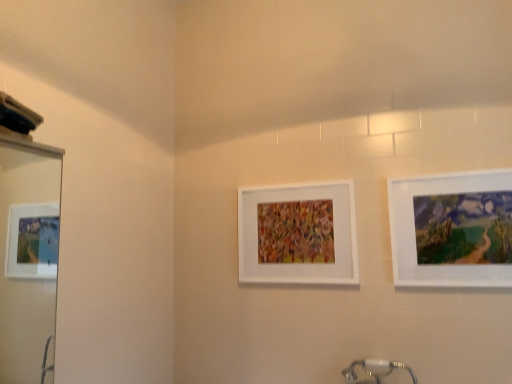
Find the location of a particular element. The width and height of the screenshot is (512, 384). white matte picture frame at center, the 1th picture frame positioned from the back is located at coordinates (298, 234).

This screenshot has width=512, height=384. What do you see at coordinates (452, 229) in the screenshot? I see `matte white picture frame at right, the 2th picture frame from the left` at bounding box center [452, 229].

Identify the location of white glossy mirror at left. The width and height of the screenshot is (512, 384). (28, 260).

Where is `picture frame that appears behind the matte white picture frame at right, which is the 1th picture frame from front to back`? The width and height of the screenshot is (512, 384). picture frame that appears behind the matte white picture frame at right, which is the 1th picture frame from front to back is located at coordinates (298, 234).

Is white matte picture frame at center, arranged as the second picture frame when viewed from the front, to the left or to the right of matte white picture frame at right, which is the 1th picture frame from front to back, in the image?

white matte picture frame at center, arranged as the second picture frame when viewed from the front, is to the left of matte white picture frame at right, which is the 1th picture frame from front to back.

Is white matte picture frame at center, which is counted as the first picture frame, starting from the left, turned away from matte white picture frame at right, which is the 1th picture frame in right-to-left order?

No, white matte picture frame at center, which is counted as the first picture frame, starting from the left, is not facing away from matte white picture frame at right, which is the 1th picture frame in right-to-left order.

Which object is more forward, white matte picture frame at center, arranged as the second picture frame when viewed from the front, or matte white picture frame at right, the second picture frame in the back-to-front sequence?

matte white picture frame at right, the second picture frame in the back-to-front sequence, is in front.

Considering the sizes of objects white matte picture frame at center, the 2th picture frame from the right, and white glossy mirror at left in the image provided, who is bigger, white matte picture frame at center, the 2th picture frame from the right, or white glossy mirror at left?

white glossy mirror at left.

Is white matte picture frame at center, which is counted as the first picture frame, starting from the left, placed right next to white glossy mirror at left?

They are not placed beside each other.

Consider the image. Can you confirm if white matte picture frame at center, arranged as the second picture frame when viewed from the front, is wider than white glossy mirror at left?

Incorrect, the width of white matte picture frame at center, arranged as the second picture frame when viewed from the front, does not surpass that of white glossy mirror at left.

Where is `the 2nd picture frame located above the white glossy mirror at left (from a real-world perspective)`? This screenshot has width=512, height=384. the 2nd picture frame located above the white glossy mirror at left (from a real-world perspective) is located at coordinates (298, 234).

Is matte white picture frame at right, which is the 1th picture frame from front to back, positioned beyond the bounds of white matte picture frame at center, arranged as the second picture frame when viewed from the front?

Yes, matte white picture frame at right, which is the 1th picture frame from front to back, is located beyond the bounds of white matte picture frame at center, arranged as the second picture frame when viewed from the front.

Is matte white picture frame at right, the second picture frame in the back-to-front sequence, next to white matte picture frame at center, which is counted as the first picture frame, starting from the left?

matte white picture frame at right, the second picture frame in the back-to-front sequence, is not next to white matte picture frame at center, which is counted as the first picture frame, starting from the left, and they're not touching.

From the image's perspective, between matte white picture frame at right, the second picture frame in the back-to-front sequence, and white matte picture frame at center, the 2th picture frame from the right, who is located below?

white matte picture frame at center, the 2th picture frame from the right, from the image's perspective.

Does matte white picture frame at right, which is the 1th picture frame in right-to-left order, have a lesser height compared to white matte picture frame at center, the 1th picture frame positioned from the back?

In fact, matte white picture frame at right, which is the 1th picture frame in right-to-left order, may be taller than white matte picture frame at center, the 1th picture frame positioned from the back.

Measure the distance from white glossy mirror at left to white matte picture frame at center, the 2th picture frame from the right.

1.34 meters.

Does white glossy mirror at left come behind white matte picture frame at center, the 1th picture frame positioned from the back?

No, white glossy mirror at left is closer to the viewer.

Is point (3, 217) closer or farther from the camera than point (335, 185)?

Clearly, point (3, 217) is more distant from the camera than point (335, 185).

From the image's perspective, is white glossy mirror at left above or below white matte picture frame at center, the 1th picture frame positioned from the back?

white glossy mirror at left is below white matte picture frame at center, the 1th picture frame positioned from the back.

Consider the image. Considering the relative positions of matte white picture frame at right, which is the 1th picture frame in right-to-left order, and white glossy mirror at left in the image provided, is matte white picture frame at right, which is the 1th picture frame in right-to-left order, to the right of white glossy mirror at left from the viewer's perspective?

Yes.

Considering the positions of objects matte white picture frame at right, the 2th picture frame from the left, and white glossy mirror at left in the image provided, who is in front, matte white picture frame at right, the 2th picture frame from the left, or white glossy mirror at left?

white glossy mirror at left is more forward.

How many degrees apart are the facing directions of matte white picture frame at right, which is the 1th picture frame in right-to-left order, and white glossy mirror at left?

87.3 degrees.

Is point (426, 255) closer or farther from the camera than point (17, 283)?

Point (426, 255) appears to be closer to the viewer than point (17, 283).

What's the angular difference between white glossy mirror at left and matte white picture frame at right, which is the 1th picture frame in right-to-left order,'s facing directions?

87.3 degrees.

From the image's perspective, which is above, white glossy mirror at left or matte white picture frame at right, which is the 1th picture frame from front to back?

From the image's view, matte white picture frame at right, which is the 1th picture frame from front to back, is above.

From their relative heights in the image, would you say white glossy mirror at left is taller or shorter than matte white picture frame at right, the 2th picture frame from the left?

Clearly, white glossy mirror at left is taller compared to matte white picture frame at right, the 2th picture frame from the left.

From a real-world perspective, between white glossy mirror at left and matte white picture frame at right, the 2th picture frame from the left, who is vertically higher?

From a 3D spatial view, matte white picture frame at right, the 2th picture frame from the left, is above.

Where is `picture frame that appears behind the matte white picture frame at right, which is the 1th picture frame in right-to-left order`? Image resolution: width=512 pixels, height=384 pixels. picture frame that appears behind the matte white picture frame at right, which is the 1th picture frame in right-to-left order is located at coordinates (298, 234).

Locate an element on the screen. Image resolution: width=512 pixels, height=384 pixels. mirror that appears in front of the white matte picture frame at center, the 2th picture frame from the right is located at coordinates (28, 260).

Looking at the image, which one is located closer to white matte picture frame at center, which is counted as the first picture frame, starting from the left, white glossy mirror at left or matte white picture frame at right, the 2th picture frame from the left?

Among the two, matte white picture frame at right, the 2th picture frame from the left, is located nearer to white matte picture frame at center, which is counted as the first picture frame, starting from the left.

Looking at the image, which one is located closer to matte white picture frame at right, the 2th picture frame from the left, white matte picture frame at center, the 1th picture frame positioned from the back, or white glossy mirror at left?

white matte picture frame at center, the 1th picture frame positioned from the back, lies closer to matte white picture frame at right, the 2th picture frame from the left, than the other object.

Considering their positions, is white glossy mirror at left positioned further to matte white picture frame at right, which is the 1th picture frame from front to back, than white matte picture frame at center, the 2th picture frame from the right?

white glossy mirror at left is positioned further to the anchor matte white picture frame at right, which is the 1th picture frame from front to back.

From the picture: Based on their spatial positions, is matte white picture frame at right, which is the 1th picture frame from front to back, or white matte picture frame at center, the 2th picture frame from the right, further from white glossy mirror at left?

matte white picture frame at right, which is the 1th picture frame from front to back.

Considering their positions, is white matte picture frame at center, which is counted as the first picture frame, starting from the left, positioned further to white glossy mirror at left than matte white picture frame at right, which is the 1th picture frame from front to back?

matte white picture frame at right, which is the 1th picture frame from front to back, is further to white glossy mirror at left.

Based on their spatial positions, is matte white picture frame at right, the second picture frame in the back-to-front sequence, or white glossy mirror at left further from white matte picture frame at center, arranged as the second picture frame when viewed from the front?

white glossy mirror at left is positioned further to the anchor white matte picture frame at center, arranged as the second picture frame when viewed from the front.

The image size is (512, 384). What are the coordinates of `picture frame situated between white glossy mirror at left and matte white picture frame at right, which is the 1th picture frame in right-to-left order, from left to right` in the screenshot? It's located at (298, 234).